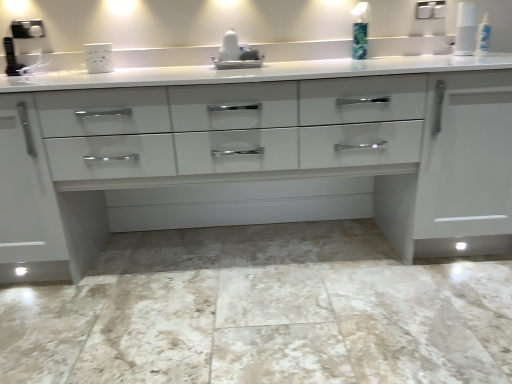
Identify the location of free point in front of white glossy chest of drawers at center. This screenshot has width=512, height=384. (249, 325).